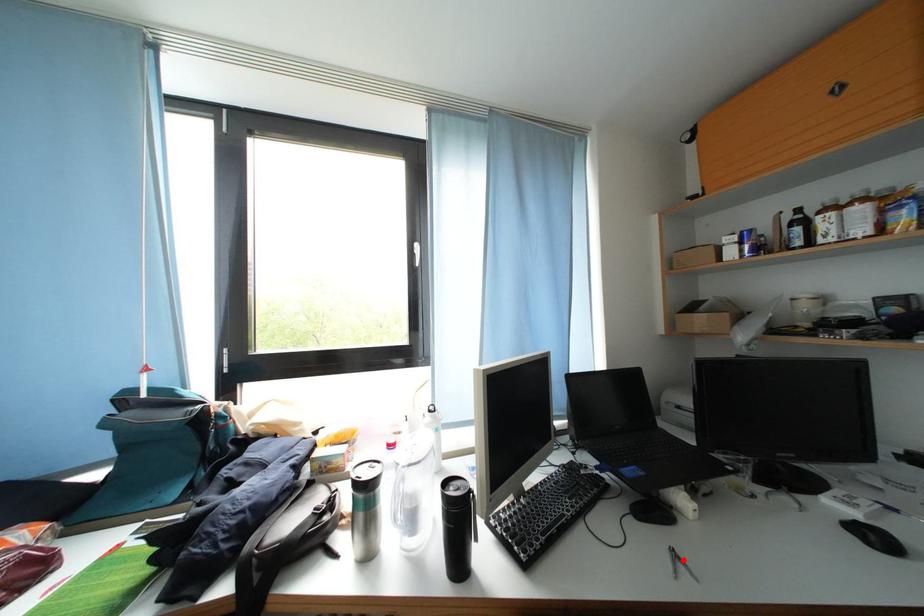
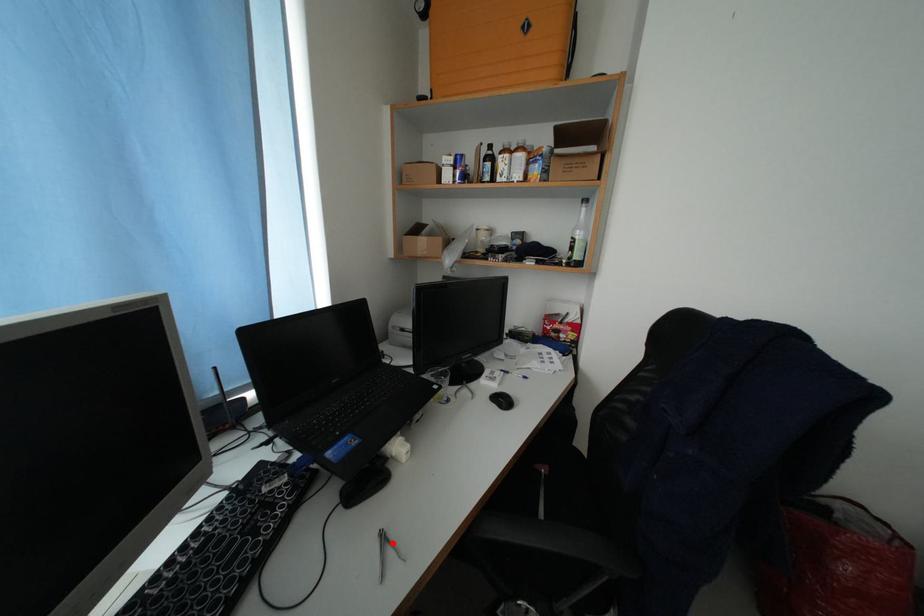
I am providing you with two images of the same scene from different viewpoints. A red point is marked on the first image and another point is marked on the second image. Does the point marked in image1 correspond to the same location as the one in image2?

Yes